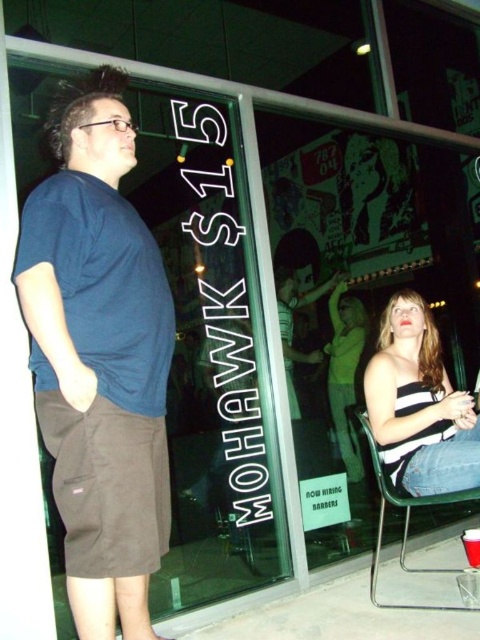
Can you confirm if dark blue t-shirt at left is taller than striped fabric top at lower right?

Correct, dark blue t-shirt at left is much taller as striped fabric top at lower right.

Is dark blue t-shirt at left thinner than striped fabric top at lower right?

Indeed, dark blue t-shirt at left has a lesser width compared to striped fabric top at lower right.

This screenshot has height=640, width=480. Find the location of `dark blue t-shirt at left`. dark blue t-shirt at left is located at coordinates tap(98, 356).

Find the location of a particular element. Image resolution: width=480 pixels, height=640 pixels. dark blue t-shirt at left is located at coordinates (98, 356).

Consider the image. Who is higher up, green fabric dress at lower right or metallic silver chair at lower right?

green fabric dress at lower right is higher up.

Can you confirm if green fabric dress at lower right is positioned to the left of metallic silver chair at lower right?

No, green fabric dress at lower right is not to the left of metallic silver chair at lower right.

Between point (356, 451) and point (407, 538), which one is positioned behind?

The point (356, 451) is behind.

You are a GUI agent. You are given a task and a screenshot of the screen. Output one action in this format:
    pyautogui.click(x=<x>, y=<y>)
    Task: Click on the green fabric dress at lower right
    This screenshot has width=480, height=640.
    Given the screenshot: What is the action you would take?
    pyautogui.click(x=345, y=372)

Does dark blue t-shirt at left have a lesser width compared to green fabric dress at lower right?

In fact, dark blue t-shirt at left might be wider than green fabric dress at lower right.

Does dark blue t-shirt at left lie in front of green fabric dress at lower right?

Yes, it is in front of green fabric dress at lower right.

Who is more distant from viewer, (100, 509) or (330, 406)?

Point (330, 406)

This screenshot has height=640, width=480. I want to click on dark blue t-shirt at left, so click(98, 356).